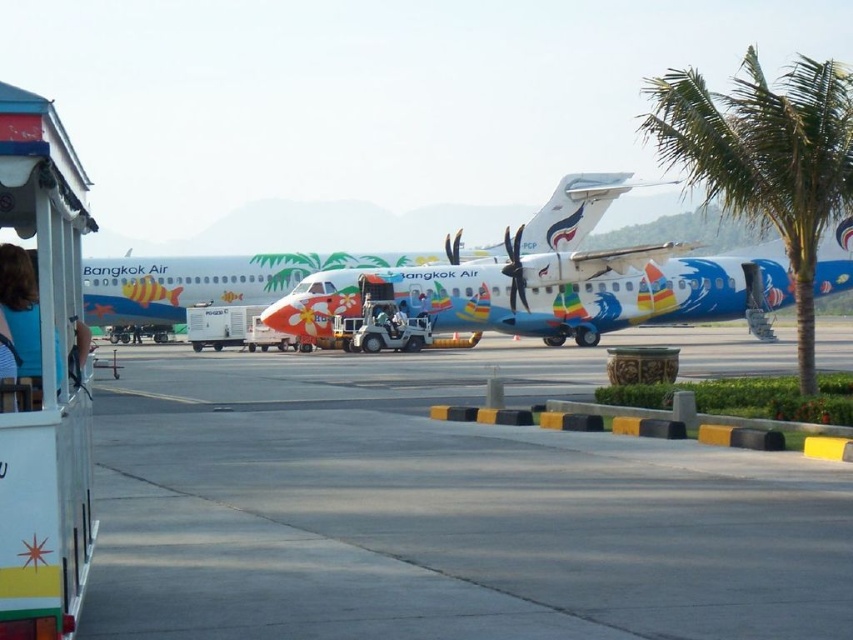
Is painted aluminum airplane at center behind green leafy palm tree at right?

Yes, painted aluminum airplane at center is behind green leafy palm tree at right.

Which is above, painted aluminum airplane at center or green leafy palm tree at right?

green leafy palm tree at right is higher up.

Does point (724, 294) come in front of point (804, 90)?

No, it is behind (804, 90).

The height and width of the screenshot is (640, 853). Find the location of `painted aluminum airplane at center`. painted aluminum airplane at center is located at coordinates (544, 294).

Is the position of smooth concrete tarmac at center more distant than that of blue striped shirt at left?

Yes.

Does point (289, 417) come farther from viewer compared to point (26, 337)?

Yes, it is.

In order to click on smooth concrete tarmac at center in this screenshot , I will do `click(438, 512)`.

Is smooth concrete tarmac at center above painted aluminum airplane at center?

No, smooth concrete tarmac at center is not above painted aluminum airplane at center.

Where is `smooth concrete tarmac at center`? smooth concrete tarmac at center is located at coordinates (438, 512).